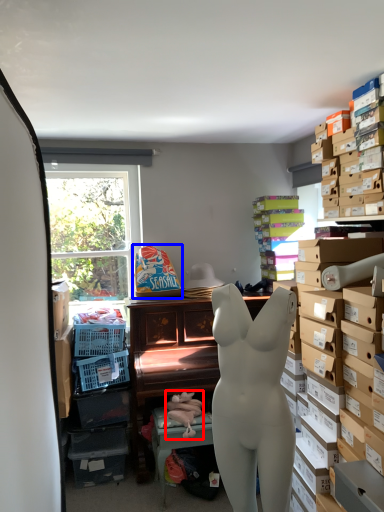
Question: Which of the following is the farthest to the observer, toy (highlighted by a red box) or toy (highlighted by a blue box)?

Choices:
 (A) toy
 (B) toy

Answer: (B)